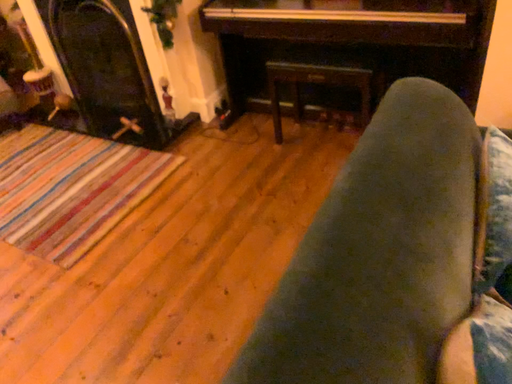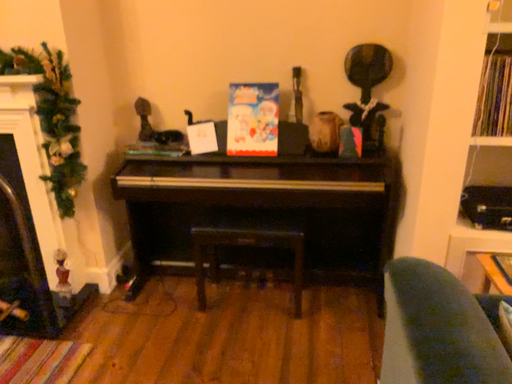
Question: Which way did the camera rotate in the video?

Choices:
 (A) rotated upward
 (B) rotated downward

Answer: (A)